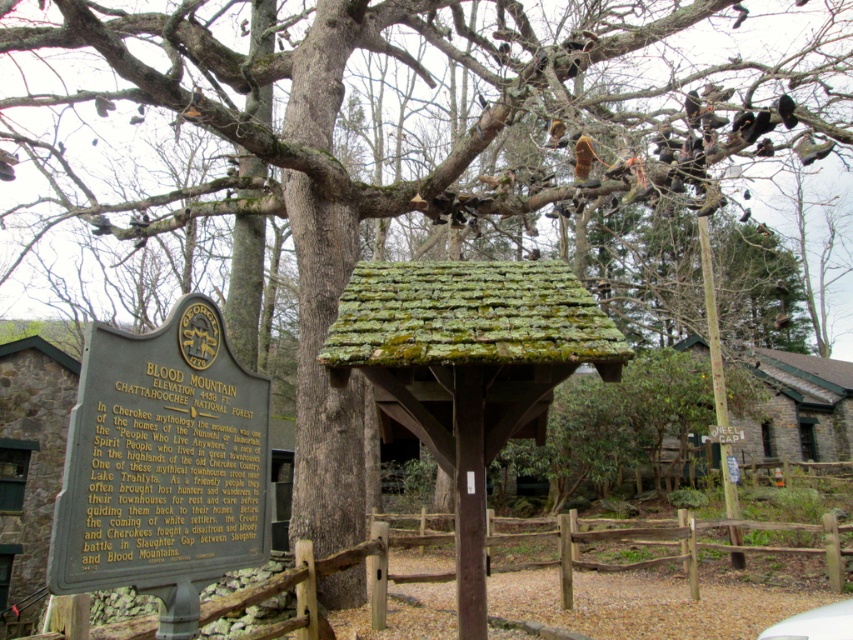
You are standing in the outdoor setting and want to take a photo of both the green mossy wood hut at lower left and the white matte car at lower right. Which object should you focus on first to ensure both are in the frame?

You should focus on the green mossy wood hut at lower left first because it is closer to you than the white matte car at lower right, ensuring both are in the frame.

You are a visitor at this outdoor location and want to find the smaller structure between the green mossy wood hut at lower left and the green mossy hut at right. Which one should you look for?

The green mossy wood hut at lower left occupies less space than the green mossy hut at right, so the smaller one is the green mossy wood hut at lower left.

You are planning to place a small garden ornament that requires a base area of 1 square meter. Given the green mossy wood hut at lower left and the brown wooden fence at lower center, which location would be more suitable for placing the ornament based on their sizes?

The brown wooden fence at lower center is larger than the green mossy wood hut at lower left, so the brown wooden fence at lower center would provide a more suitable location for placing the ornament as it has a larger base area.